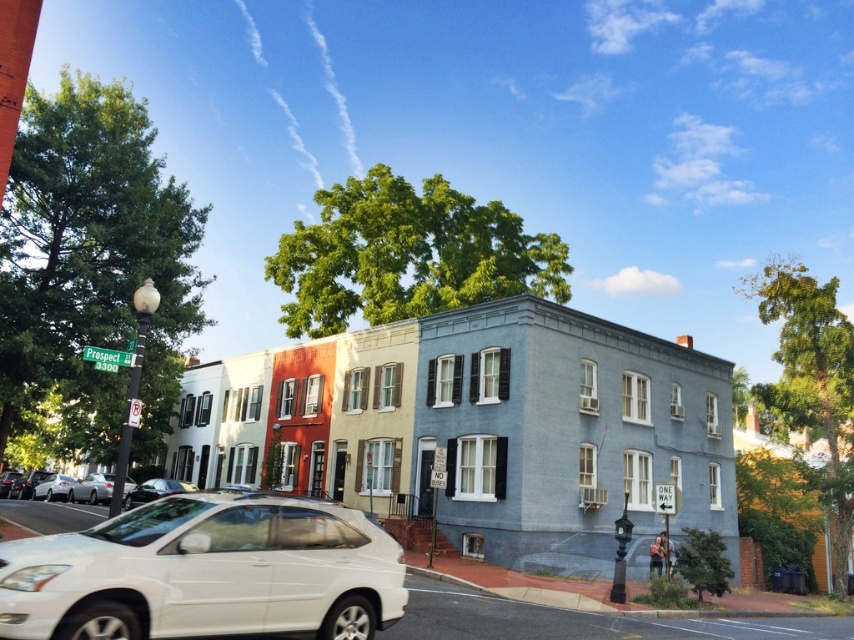
You are a delivery driver who needs to park your 5.5 meter long truck between the matte white sedan at center and the closest townhouse. Is there enough space for your truck to fit without touching either the sedan or the townhouse?

The distance between the matte white sedan at center and the closest townhouse is 17.01 meters. Since your truck is 5.5 meters long, there is sufficient space to park it between them without touching either the sedan or the townhouse.

You are a delivery driver who needs to park your 1.8 meters tall delivery van between the matte white sedan at center and the metallic silver sedan at center. Can you fit your van between them based on their heights?

The matte white sedan at center is much taller than the metallic silver sedan at center. Since the delivery van is 1.8 meters tall, it can fit between them as the height difference allows enough vertical space.